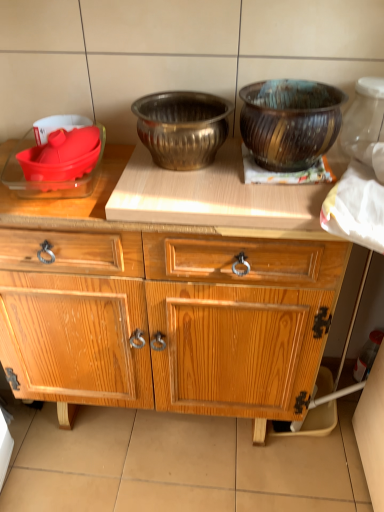
I want to click on free point below matte red bowl at left, placed as the third bowl when sorted from right to left (from a real-world perspective), so click(x=66, y=181).